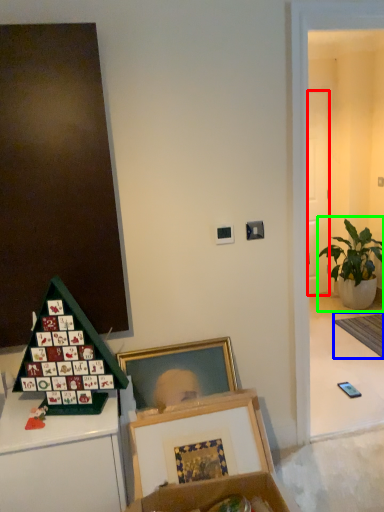
Question: Which object is positioned closest to door (highlighted by a red box)? Select from mat (highlighted by a blue box) and houseplant (highlighted by a green box).

Choices:
 (A) mat
 (B) houseplant

Answer: (B)